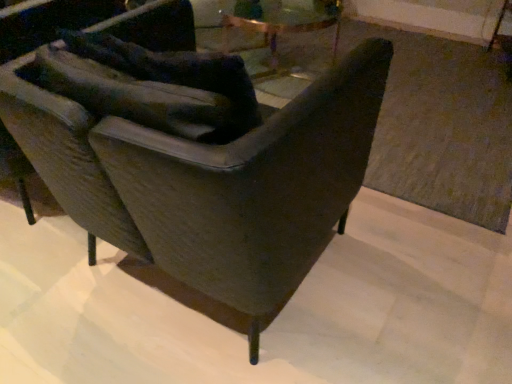
Question: Can dark gray leather rocking chair at center be found inside matte gray chair at left?

Choices:
 (A) yes
 (B) no

Answer: (B)

Question: Does matte gray chair at left appear on the right side of dark gray leather rocking chair at center?

Choices:
 (A) no
 (B) yes

Answer: (A)

Question: Is matte gray chair at left with dark gray leather rocking chair at center?

Choices:
 (A) no
 (B) yes

Answer: (A)

Question: From the image's perspective, is matte gray chair at left under dark gray leather rocking chair at center?

Choices:
 (A) yes
 (B) no

Answer: (B)

Question: Considering the relative positions of matte gray chair at left and dark gray leather rocking chair at center in the image provided, is matte gray chair at left to the left of dark gray leather rocking chair at center from the viewer's perspective?

Choices:
 (A) no
 (B) yes

Answer: (B)

Question: From a real-world perspective, does matte gray chair at left sit lower than dark gray leather rocking chair at center?

Choices:
 (A) no
 (B) yes

Answer: (B)

Question: Is the depth of dark gray leather rocking chair at center less than that of matte gray chair at left?

Choices:
 (A) no
 (B) yes

Answer: (B)

Question: From the image's perspective, is dark gray leather rocking chair at center located beneath matte gray chair at left?

Choices:
 (A) no
 (B) yes

Answer: (B)

Question: Is dark gray leather rocking chair at center bigger than matte gray chair at left?

Choices:
 (A) yes
 (B) no

Answer: (A)

Question: Can you confirm if dark gray leather rocking chair at center is smaller than matte gray chair at left?

Choices:
 (A) no
 (B) yes

Answer: (A)

Question: Considering the relative positions of dark gray leather rocking chair at center and matte gray chair at left in the image provided, is dark gray leather rocking chair at center to the left of matte gray chair at left from the viewer's perspective?

Choices:
 (A) yes
 (B) no

Answer: (B)

Question: Considering the relative positions of dark gray leather rocking chair at center and matte gray chair at left in the image provided, is dark gray leather rocking chair at center to the right of matte gray chair at left from the viewer's perspective?

Choices:
 (A) yes
 (B) no

Answer: (A)

Question: Looking at their shapes, would you say dark gray leather rocking chair at center is wider or thinner than matte gray chair at left?

Choices:
 (A) wide
 (B) thin

Answer: (A)